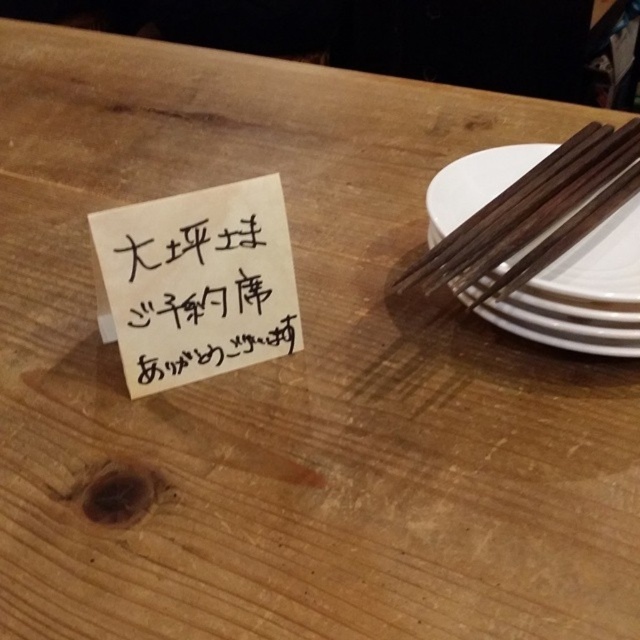
You are organizing a small event and need to place a 1cm thick menu on the table. You see the white paper at upper left and the white glossy plate at right. Which object can better support the menu without bending?

The white glossy plate at right is thicker than the white paper at upper left, so it can better support the menu without bending.

You are organizing items on a wooden table and need to place a new item between the white paper at upper left and the white glossy plate at right. Which object should you place the new item closer to if you want it to be closer to the shorter object?

The white paper at upper left has a lesser height compared to the white glossy plate at right, so you should place the new item closer to the white paper at upper left to be near the shorter object.